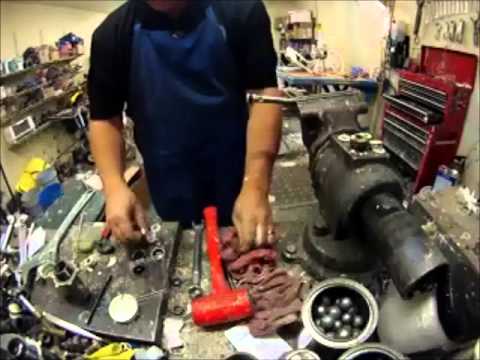
Locate an element on the screen. silver container is located at coordinates (424, 335).